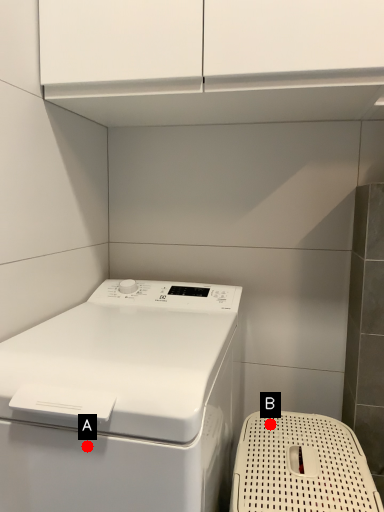
Question: Two points are circled on the image, labeled by A and B beside each circle. Which point is closer to the camera?

Choices:
 (A) A is closer
 (B) B is closer

Answer: (A)